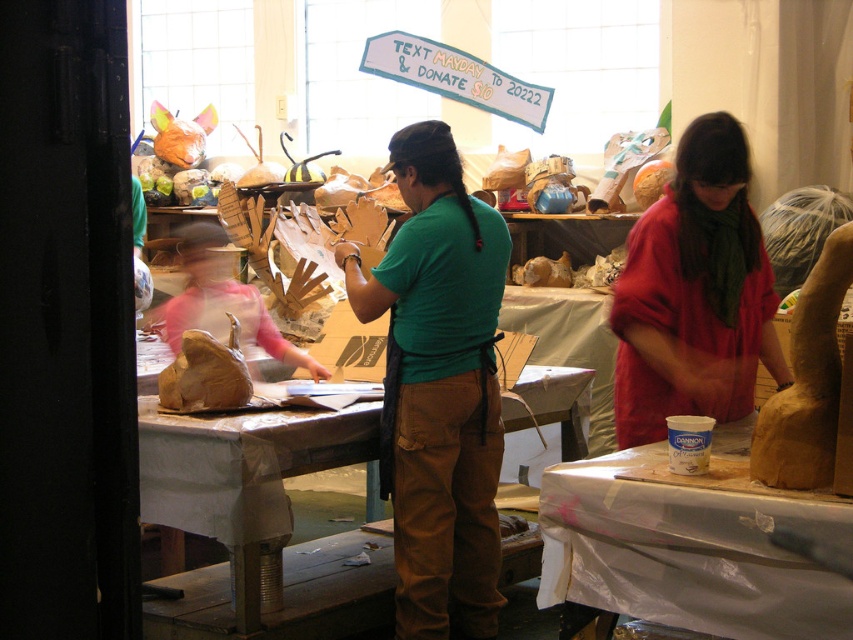
Does point (749, 516) lie behind point (212, 516)?

No, it is in front of (212, 516).

Can you confirm if white plastic table at lower right is bigger than brown paper table at center?

No.

The image size is (853, 640). Identify the location of white plastic table at lower right. (686, 552).

Is green cotton shirt at center smaller than matte pink shirt at center?

No.

Does green cotton shirt at center come in front of matte pink shirt at center?

Yes, green cotton shirt at center is in front of matte pink shirt at center.

Is point (467, 284) closer to viewer compared to point (189, 291)?

Yes, point (467, 284) is in front of point (189, 291).

This screenshot has width=853, height=640. In order to click on green cotton shirt at center in this screenshot , I will do `click(438, 388)`.

Can you confirm if green cotton shirt at center is positioned to the right of white plastic table at lower right?

In fact, green cotton shirt at center is to the left of white plastic table at lower right.

Where is `green cotton shirt at center`? This screenshot has height=640, width=853. green cotton shirt at center is located at coordinates (438, 388).

Where is `green cotton shirt at center`? Image resolution: width=853 pixels, height=640 pixels. green cotton shirt at center is located at coordinates (438, 388).